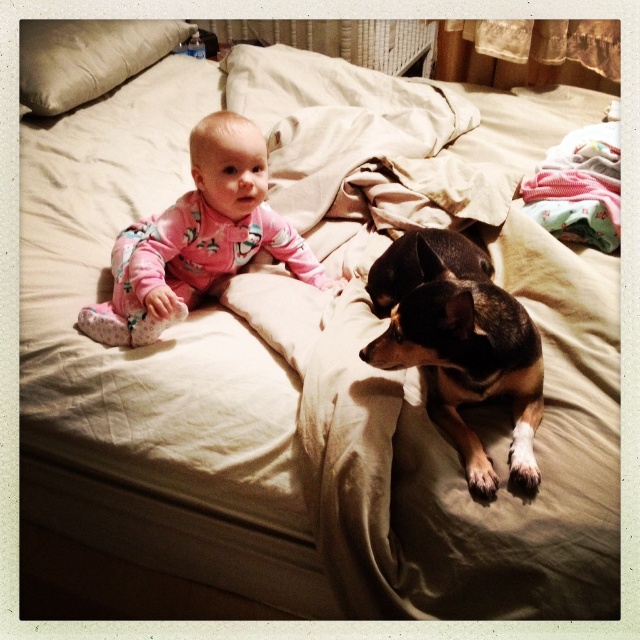
You are a photographer setting up a shot of the baby and dog on the bed. You want to focus on the pink fleece onesie at center and the beige fabric pillow at upper left. Which object should you adjust your camera focus to first if you want to capture both in sharp detail without moving the camera?

You should focus on the pink fleece onesie at center first because it is closer to the viewer than the beige fabric pillow at upper left. By focusing on the closer object, the farther one may still be in acceptable focus depending on the depth of field.

You are a photographer taking a picture of the brown and black fur dog at center. The camera requires the subject to be positioned at coordinates between 0.5 and 0.6 on the x and y axes. Is the dog within the desired area?

The brown and black fur dog at center is located at coordinates 0.536 on the x and 0.717 on the y. Since both coordinates fall within the 0.5 to 0.6 range on the x axis, but the y coordinate is 0.717 which is above 0.6, the dog is partially within the desired area but not fully. However, the camera might still capture it if the focus allows.

You are a parent trying to place a beige fabric pillow at upper left on the bed where your baby is wearing a pink fleece onesie at center. Considering the size difference between the two items, which item will require more space on the bed?

The beige fabric pillow at upper left requires more space on the bed because it is larger than the pink fleece onesie at center.